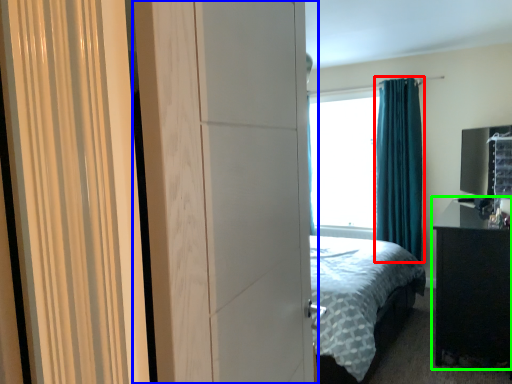
Question: Estimate the real-world distances between objects in this image. Which object is closer to curtain (highlighted by a red box), screen door (highlighted by a blue box) or nightstand (highlighted by a green box)?

Choices:
 (A) screen door
 (B) nightstand

Answer: (B)